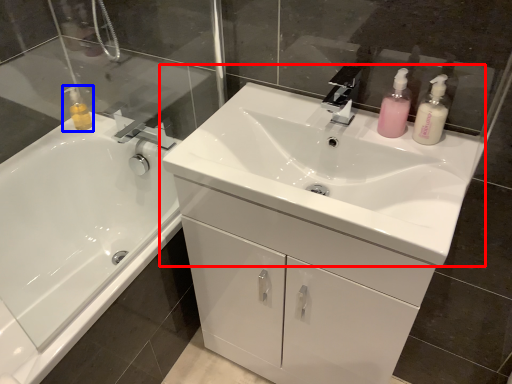
Question: Which object is closer to the camera taking this photo, sink (highlighted by a red box) or toiletry (highlighted by a blue box)?

Choices:
 (A) sink
 (B) toiletry

Answer: (A)